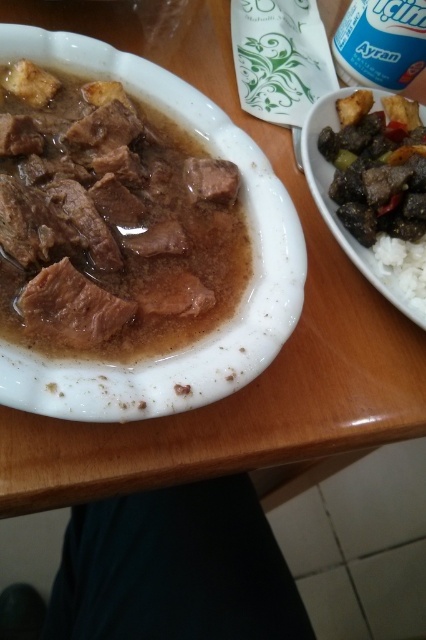
Question: Does brown glossy meat at left appear on the right side of white creamy yogurt at upper right?

Choices:
 (A) no
 (B) yes

Answer: (A)

Question: Which point is closer to the camera?

Choices:
 (A) (135, 296)
 (B) (362, 45)

Answer: (A)

Question: Is brown glossy meat at left above white creamy yogurt at upper right?

Choices:
 (A) no
 (B) yes

Answer: (A)

Question: Does brown glossy meat at left appear on the right side of white creamy yogurt at upper right?

Choices:
 (A) yes
 (B) no

Answer: (B)

Question: Which point is closer to the camera?

Choices:
 (A) (94, 129)
 (B) (348, 150)
 (C) (377, 38)

Answer: (A)

Question: Among these objects, which one is farthest from the camera?

Choices:
 (A) brown glossy meat at left
 (B) white creamy yogurt at upper right
 (C) brown glossy meat at upper right

Answer: (B)